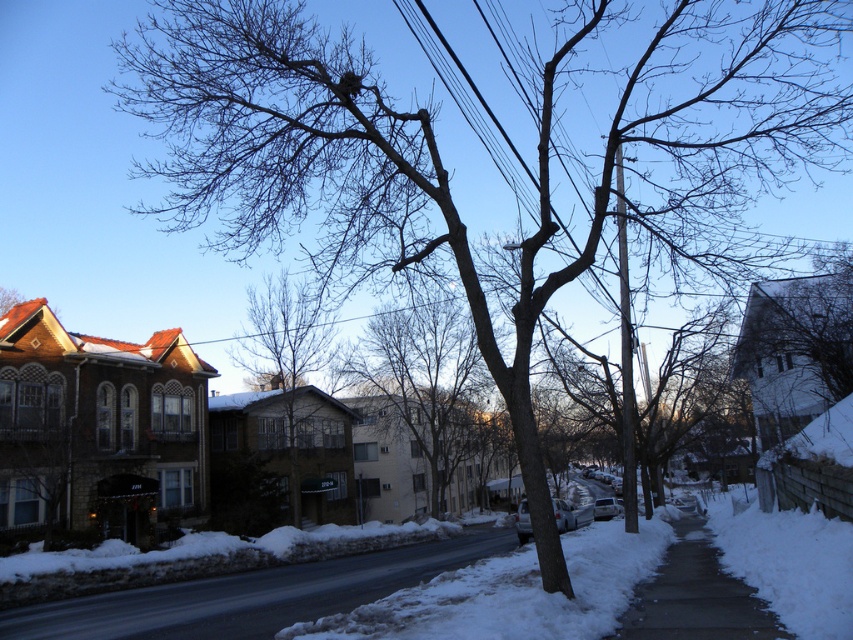
Is point (490, 538) positioned behind point (299, 310)?

Yes, it is.

This screenshot has height=640, width=853. Describe the element at coordinates (250, 595) in the screenshot. I see `black asphalt road at center` at that location.

The height and width of the screenshot is (640, 853). I want to click on black asphalt road at center, so click(250, 595).

Can you confirm if black asphalt road at center is positioned above gray concrete sidewalk at lower right?

Actually, black asphalt road at center is below gray concrete sidewalk at lower right.

Is black asphalt road at center further to the viewer compared to gray concrete sidewalk at lower right?

Yes, black asphalt road at center is further from the viewer.

Where is `black asphalt road at center`? The height and width of the screenshot is (640, 853). black asphalt road at center is located at coordinates (250, 595).

Looking at this image, is bare branches at center further to camera compared to brown textured building at center?

No, it is in front of brown textured building at center.

Can you confirm if bare branches at center is thinner than brown textured building at center?

Yes.

The width and height of the screenshot is (853, 640). What do you see at coordinates (422, 410) in the screenshot?
I see `bare branches at center` at bounding box center [422, 410].

At what (x,y) coordinates should I click in order to perform the action: click on bare branches at center. Please return your answer as a coordinate pair (x, y). The height and width of the screenshot is (640, 853). Looking at the image, I should click on (422, 410).